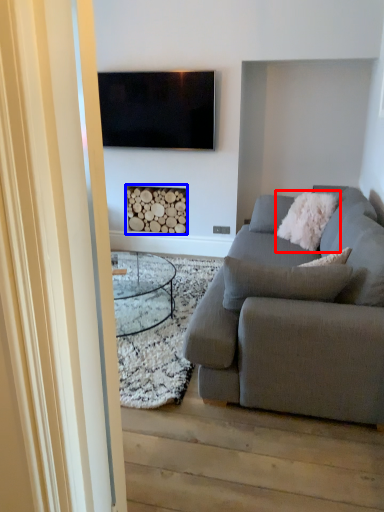
Question: Among these objects, which one is nearest to the camera, pillow (highlighted by a red box) or fireplace (highlighted by a blue box)?

Choices:
 (A) pillow
 (B) fireplace

Answer: (A)